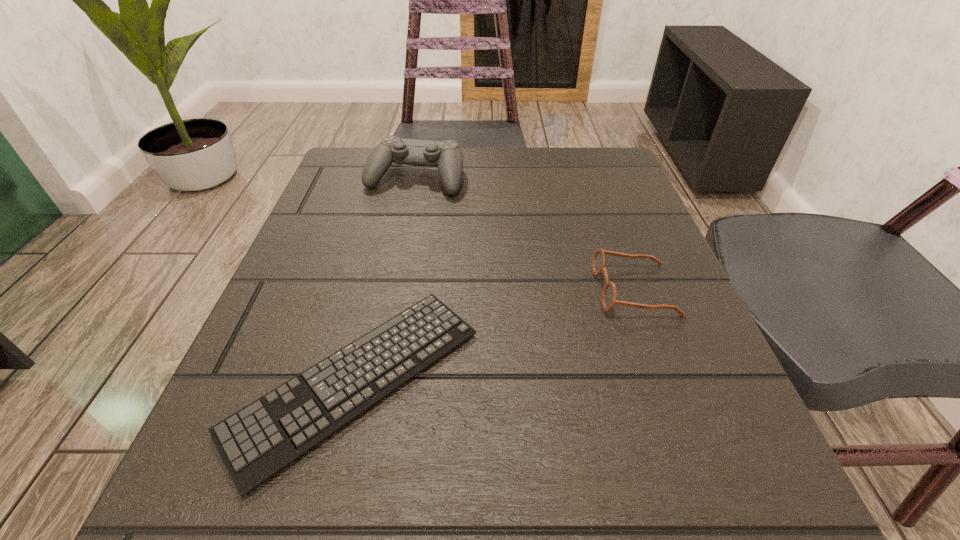
Find the location of `vacant area that lies between the second shortest object and the computer keyboard`. vacant area that lies between the second shortest object and the computer keyboard is located at coordinates (495, 335).

The height and width of the screenshot is (540, 960). What are the coordinates of `free point between the rightmost object and the tallest object` in the screenshot? It's located at (525, 234).

Locate an element on the screen. empty location between the farthest object and the rightmost object is located at coordinates tap(525, 234).

Find the location of a particular element. The image size is (960, 540). the second closest object to the control is located at coordinates (608, 297).

Choose which object is the nearest neighbor to the control. Please provide its 2D coordinates. Your answer should be formatted as a tuple, i.e. [(x, y)], where the tuple contains the x and y coordinates of a point satisfying the conditions above.

[(256, 442)]

This screenshot has height=540, width=960. I want to click on free region that satisfies the following two spatial constraints: 1. on the front-facing side of the second shortest object; 2. on the front side of the computer keyboard, so click(667, 380).